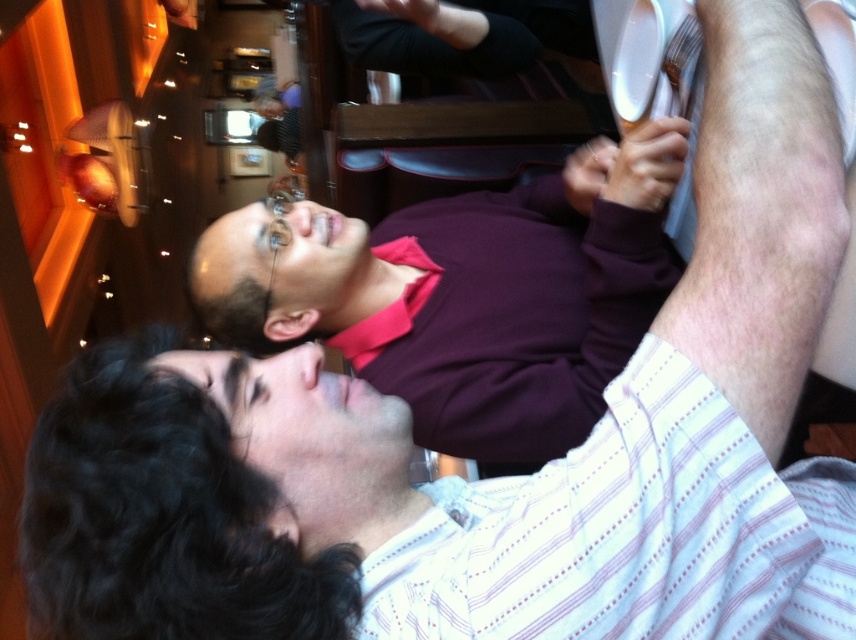
You are standing in a restaurant and want to take a photo of the point at coordinates (526, 202). The camera you are using has a minimum focus distance of 5 feet. Will the camera be able to focus on the point?

The point at coordinates (526, 202) is 4.98 feet from the camera, which is slightly less than the minimum focus distance of 5 feet. Therefore, the camera may not be able to focus on the point as it is too close.

You are a photographer trying to capture both the maroon shirt at upper center and the white striped shirt at upper right in a single frame. Given the camera you have can only focus on objects within a 1.5 meter width, can both shirts fit within the frame?

The maroon shirt at upper center is wider than the white striped shirt at upper right. Since the camera can focus on objects within a 1.5 meter width, both shirts can fit within the frame as long as their combined width does not exceed 1.5 meters. However, the exact feasibility depends on the individual widths of each shirt and their positioning in the scene.